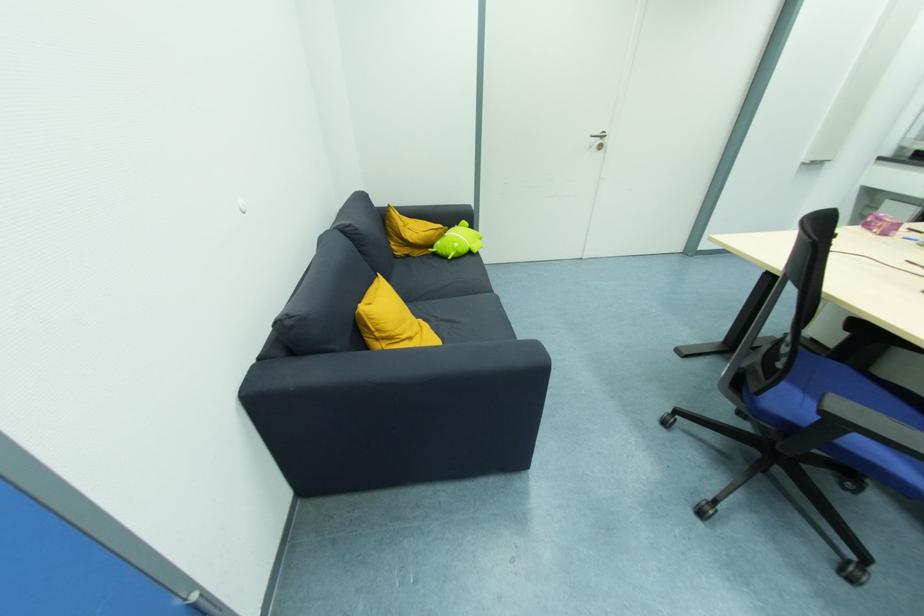
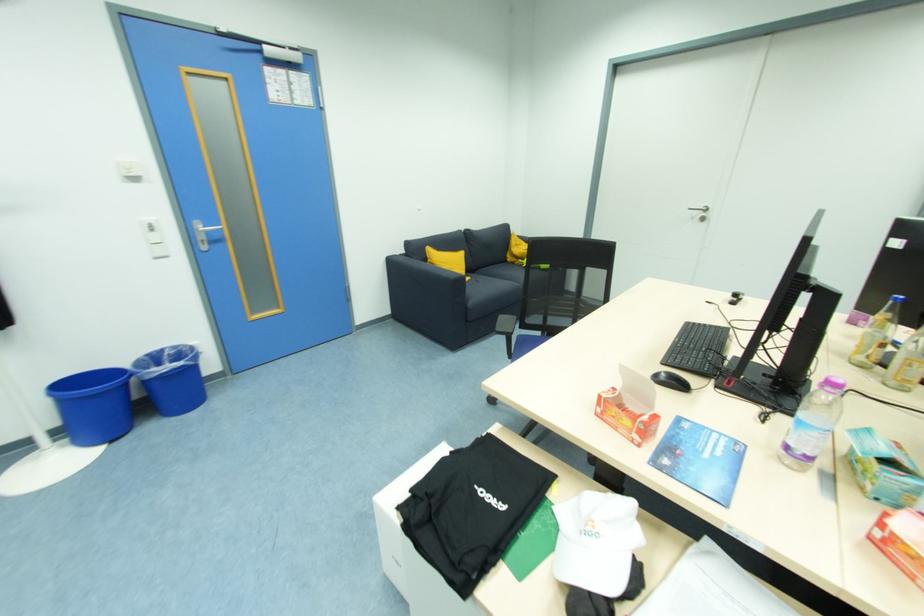
Locate, in the second image, the point that corresponds to [603,148] in the first image.

(706, 221)